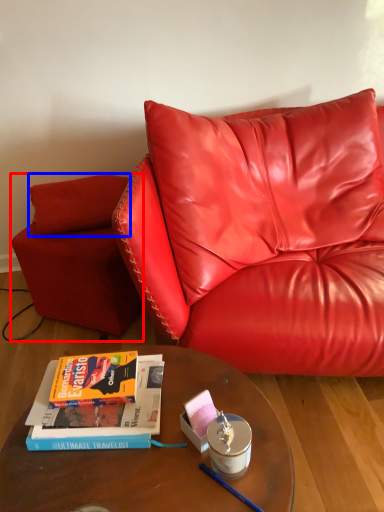
Question: Which object appears closest to the camera in this image, armchair (highlighted by a red box) or pillow (highlighted by a blue box)?

Choices:
 (A) armchair
 (B) pillow

Answer: (A)